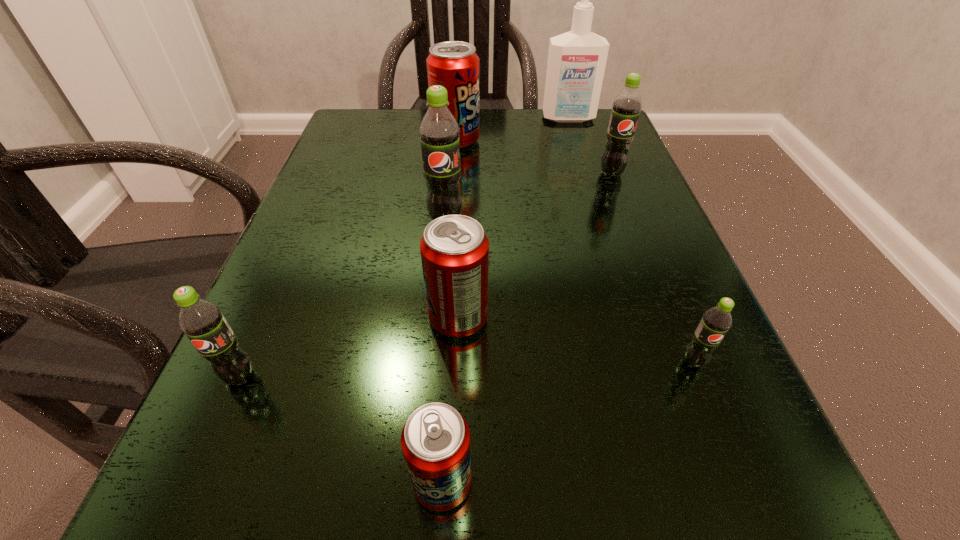
Image resolution: width=960 pixels, height=540 pixels. Identify the location of the fourth nearest object. (454, 249).

The width and height of the screenshot is (960, 540). I want to click on the second biggest red soda can, so click(x=454, y=249).

Find the location of a particular element. This screenshot has height=540, width=960. the smallest green soda is located at coordinates (717, 320).

This screenshot has height=540, width=960. I want to click on the nearest soda can, so click(x=435, y=440).

At what (x,y) coordinates should I click in order to perform the action: click on the nearest object. Please return your answer as a coordinate pair (x, y). Image resolution: width=960 pixels, height=540 pixels. Looking at the image, I should click on (435, 440).

Locate an element on the screen. Image resolution: width=960 pixels, height=540 pixels. free space located 0.260m on the front label of the cleansing agent is located at coordinates [590, 188].

This screenshot has height=540, width=960. In order to click on free space located 0.300m on the front label of the tallest soda can in this screenshot , I will do `click(430, 386)`.

At what (x,y) coordinates should I click in order to perform the action: click on blank space located 0.060m on the front label of the third farthest object. Please return your answer as a coordinate pair (x, y). Looking at the image, I should click on (621, 199).

This screenshot has width=960, height=540. What are the coordinates of `free space located on the front of the farthest soda can` in the screenshot? It's located at (452, 196).

This screenshot has height=540, width=960. Find the location of `free space located 0.150m on the front label of the leftmost green soda`. free space located 0.150m on the front label of the leftmost green soda is located at coordinates (172, 526).